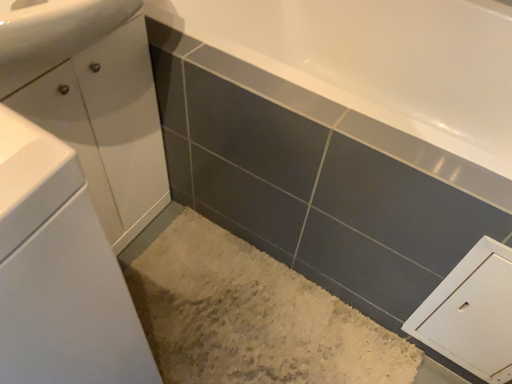
Question: Is point (30, 173) closer or farther from the camera than point (140, 51)?

Choices:
 (A) closer
 (B) farther

Answer: (A)

Question: Is white glossy cabinet at left, which ranks as the 2th bathroom cabinet in back-to-front order, situated inside white glossy cabinet at left, the 1th bathroom cabinet from the back, or outside?

Choices:
 (A) inside
 (B) outside

Answer: (B)

Question: Considering the real-world distances, which object is farthest from the white glossy cabinet at left, the 1th bathroom cabinet from the back?

Choices:
 (A) white glossy cabinet at left, which ranks as the 2th bathroom cabinet in back-to-front order
 (B) white matte cabinet at lower right

Answer: (B)

Question: Considering the real-world distances, which object is closest to the white glossy cabinet at left, the 2th bathroom cabinet positioned from the front?

Choices:
 (A) white glossy cabinet at left, the 1th bathroom cabinet when ordered from front to back
 (B) white matte cabinet at lower right

Answer: (A)